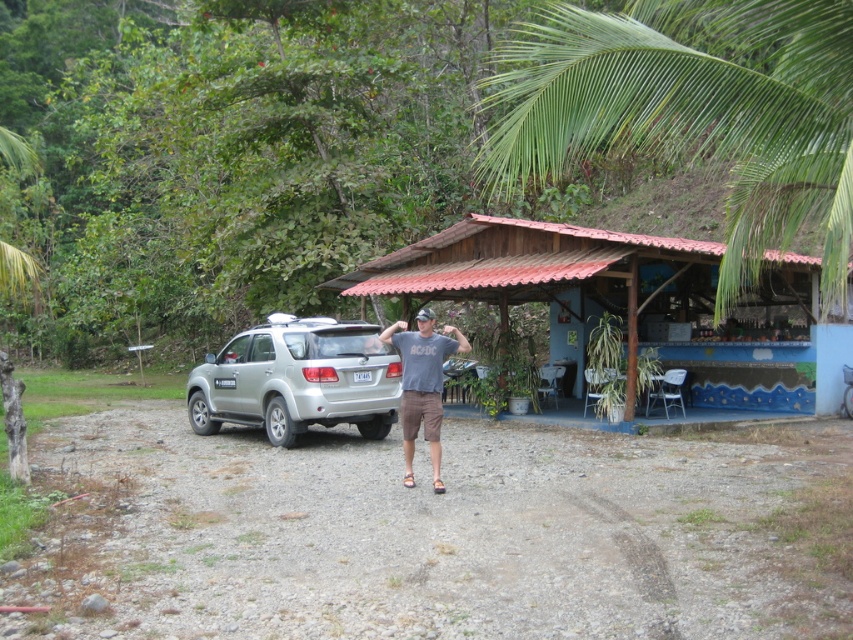
You are a drone operator trying to capture a photo of the man in the gray ACDC shirt and the silver SUV. The palm tree might block the shot. Based on the coordinates provided, will the palm tree at point (694, 109) block the view between the man and the silver SUV?

The green leafy palm tree at upper right is represented by point (694, 109). Since the palm tree is at the upper right, it is unlikely to block the view between the man and the silver SUV which are positioned lower in the scene.

You are standing in the rural outdoor setting shown in the image. You notice two points marked in the scene. Which point, point (602, 292) or point (306, 326), is closer to you?

Point (602, 292) is further to the viewer than point (306, 326), so the closer point to you is point (306, 326).